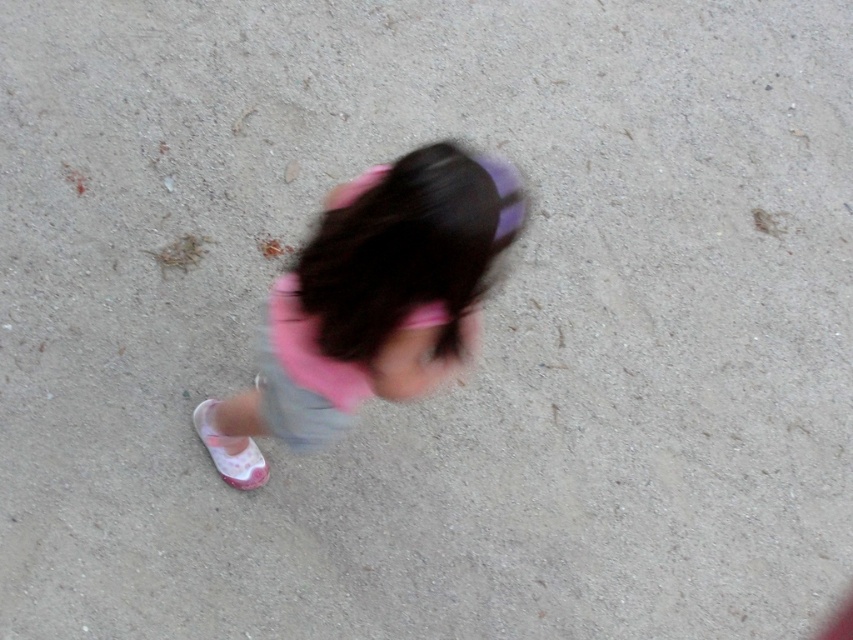
Is point (473, 204) more distant than point (250, 481)?

No, (473, 204) is in front of (250, 481).

Does dark brown silky hair at center appear over pink fabric shoe at lower left?

Indeed, dark brown silky hair at center is positioned over pink fabric shoe at lower left.

Between point (450, 248) and point (206, 440), which one is positioned in front?

Positioned in front is point (450, 248).

Locate an element on the screen. dark brown silky hair at center is located at coordinates (408, 248).

Is pink fabric dress at center closer to the viewer compared to pink fabric shoe at lower left?

Yes, pink fabric dress at center is in front of pink fabric shoe at lower left.

How far apart are pink fabric dress at center and pink fabric shoe at lower left?

pink fabric dress at center and pink fabric shoe at lower left are 19.14 inches apart.

Find the location of a particular element. The height and width of the screenshot is (640, 853). pink fabric dress at center is located at coordinates (x=370, y=301).

Between dark brown silky hair at center and pink fabric hand at center, which one is positioned lower?

pink fabric hand at center is lower down.

Between point (383, 310) and point (389, 353), which one is positioned behind?

Point (389, 353)

The width and height of the screenshot is (853, 640). I want to click on dark brown silky hair at center, so click(x=408, y=248).